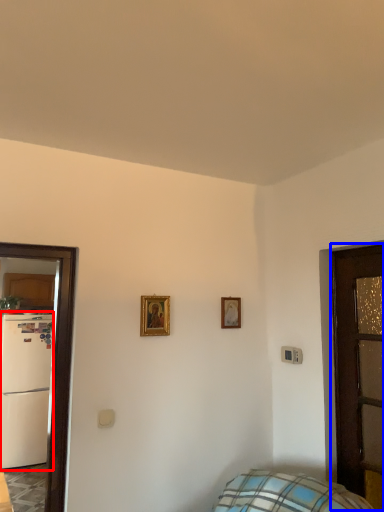
Question: Which point is closer to the camera, fridge (highlighted by a red box) or door (highlighted by a blue box)?

Choices:
 (A) fridge
 (B) door

Answer: (B)